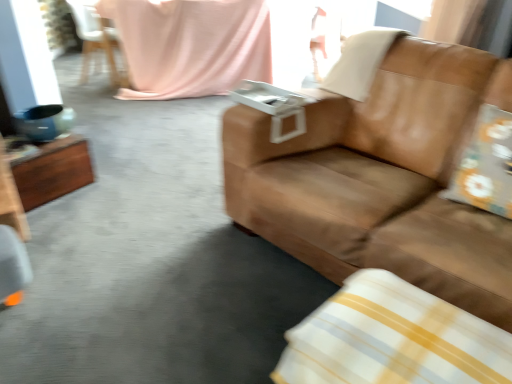
Find the location of a particular element. The image size is (512, 384). free spot to the right of wooden table at left is located at coordinates (106, 202).